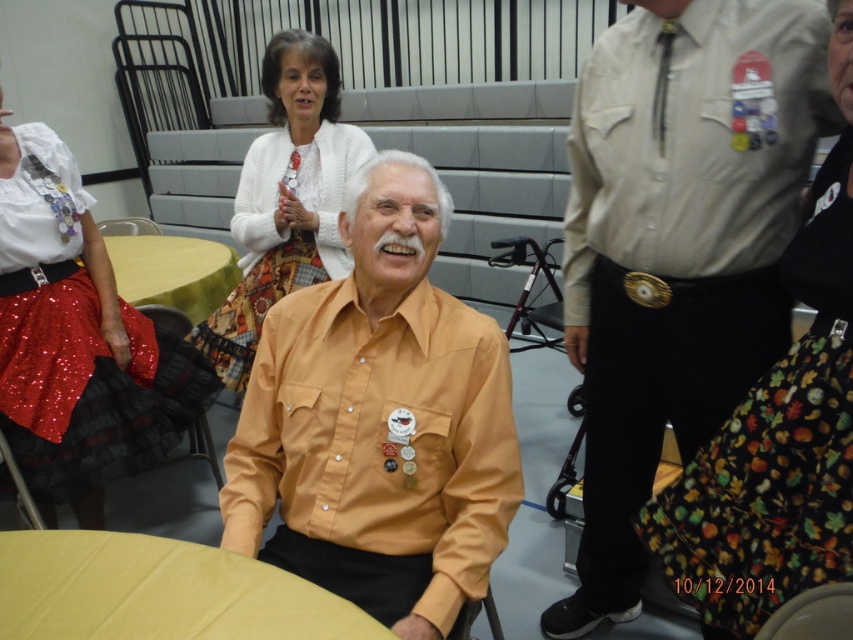
Measure the distance between shiny sequined skirt at left and shiny sequined skirt at lower left.

shiny sequined skirt at left is 30.45 centimeters away from shiny sequined skirt at lower left.

Between shiny sequined skirt at left and shiny sequined skirt at lower left, which one appears on the right side from the viewer's perspective?

shiny sequined skirt at lower left is more to the right.

Locate an element on the screen. The width and height of the screenshot is (853, 640). shiny sequined skirt at left is located at coordinates [x=77, y=340].

Between point (660, 294) and point (132, 216), which one is positioned in front?

Point (660, 294) is in front.

Does beige cotton shirt at center have a greater height compared to wooden chair at center?

Yes.

You are a GUI agent. You are given a task and a screenshot of the screen. Output one action in this format:
    pyautogui.click(x=<x>, y=<y>)
    Task: Click on the beige cotton shirt at center
    
    Given the screenshot: What is the action you would take?
    pyautogui.click(x=677, y=246)

You are a GUI agent. You are given a task and a screenshot of the screen. Output one action in this format:
    pyautogui.click(x=<x>, y=<y>)
    Task: Click on the beige cotton shirt at center
    The width and height of the screenshot is (853, 640).
    Given the screenshot: What is the action you would take?
    pyautogui.click(x=677, y=246)

Which is more to the left, orange cotton shirt at center or shiny sequined skirt at lower left?

shiny sequined skirt at lower left is more to the left.

Which of these two, orange cotton shirt at center or shiny sequined skirt at lower left, stands shorter?

With less height is shiny sequined skirt at lower left.

Is point (445, 566) more distant than point (202, 413)?

No, (445, 566) is closer to viewer.

Image resolution: width=853 pixels, height=640 pixels. In order to click on orange cotton shirt at center in this screenshot , I will do `click(379, 420)`.